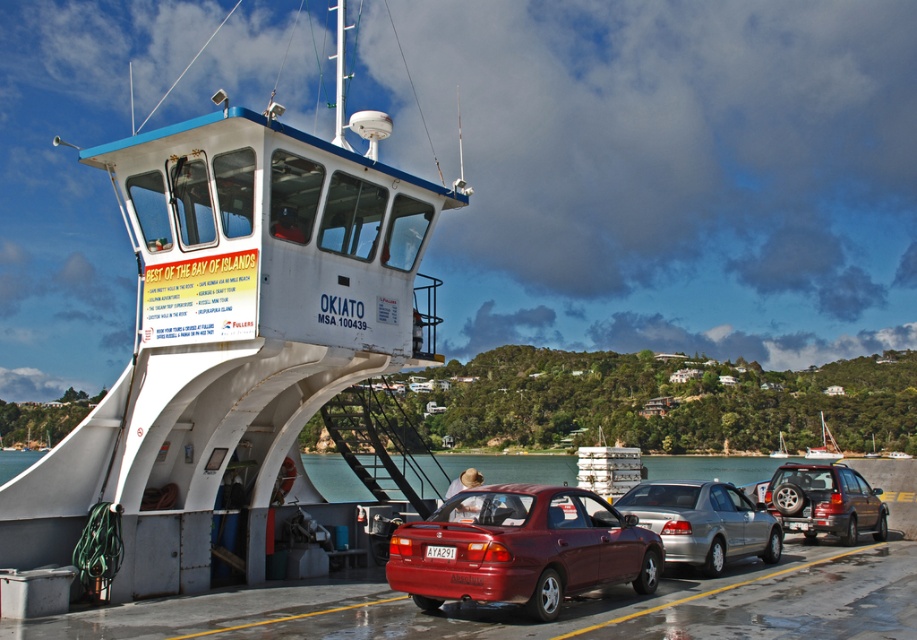
Does white matte ferry at center appear on the right side of metallic brown suv at center right?

Incorrect, white matte ferry at center is not on the right side of metallic brown suv at center right.

Where is `white matte ferry at center`? white matte ferry at center is located at coordinates (231, 339).

I want to click on white matte ferry at center, so click(x=231, y=339).

Does point (847, 496) come farther from viewer compared to point (815, 445)?

That is False.

Between metallic brown suv at center right and wooden sailboat at center, which one has less height?

metallic brown suv at center right is shorter.

Who is more distant from viewer, (787,493) or (826,442)?

The point (826,442) is more distant.

You are a GUI agent. You are given a task and a screenshot of the screen. Output one action in this format:
    pyautogui.click(x=<x>, y=<y>)
    Task: Click on the metallic brown suv at center right
    
    Given the screenshot: What is the action you would take?
    pyautogui.click(x=825, y=500)

The height and width of the screenshot is (640, 917). I want to click on wooden sailboat at center, so 824,445.

The height and width of the screenshot is (640, 917). Find the location of `wooden sailboat at center`. wooden sailboat at center is located at coordinates pos(824,445).

Locate an element on the screen. The height and width of the screenshot is (640, 917). wooden sailboat at center is located at coordinates pos(824,445).